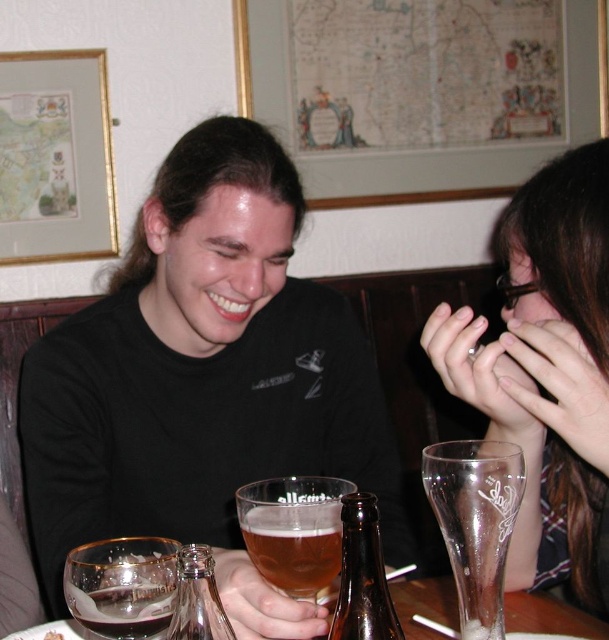
Does black matte shirt at center appear over transparent glass at lower left?

Correct, black matte shirt at center is located above transparent glass at lower left.

Is point (225, 417) positioned before point (118, 541)?

No, (225, 417) is further to viewer.

Where is `black matte shirt at center`? The image size is (609, 640). black matte shirt at center is located at coordinates (203, 381).

Is point (161, 560) positioned in front of point (421, 593)?

Yes, it is.

Is transparent glass at lower left above transparent glass at lower center?

Correct, transparent glass at lower left is located above transparent glass at lower center.

Who is more forward, (143, 592) or (576, 636)?

Point (143, 592) is in front.

This screenshot has height=640, width=609. Identify the location of transparent glass at lower left. (122, 586).

Can you confirm if clear plastic glass at right is wider than clear glass beer glass at right?

Indeed, clear plastic glass at right has a greater width compared to clear glass beer glass at right.

Where is `clear plastic glass at right`? clear plastic glass at right is located at coordinates (546, 371).